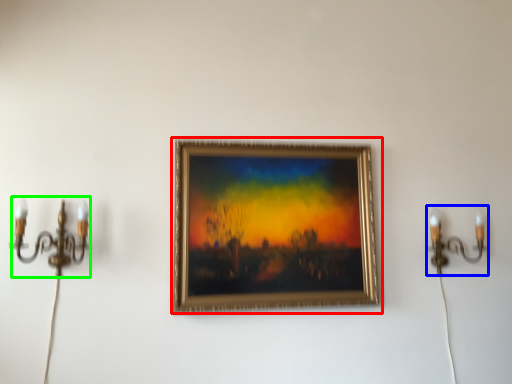
Question: Based on their relative distances, which object is nearer to picture frame (highlighted by a red box)? Choose from candle holder (highlighted by a blue box) and candle holder (highlighted by a green box).

Choices:
 (A) candle holder
 (B) candle holder

Answer: (A)